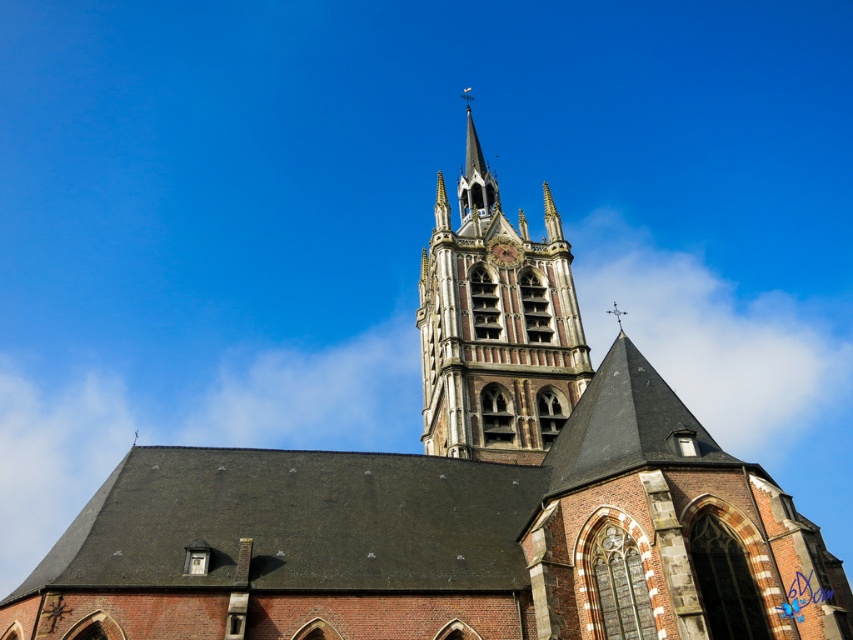
Question: Among these points, which one is nearest to the camera?

Choices:
 (A) (468, 182)
 (B) (430, 256)
 (C) (498, 246)

Answer: (C)

Question: Which object is closer to the camera taking this photo?

Choices:
 (A) polished silver spire at upper center
 (B) brown stone tower at center

Answer: (B)

Question: Which object appears farthest from the camera in this image?

Choices:
 (A) brown stone tower at center
 (B) polished silver spire at upper center

Answer: (B)

Question: Does polished silver spire at upper center appear over brass textured clock at upper center?

Choices:
 (A) yes
 (B) no

Answer: (A)

Question: Does brown stone tower at center have a greater width compared to brass textured clock at upper center?

Choices:
 (A) yes
 (B) no

Answer: (A)

Question: Is brown stone tower at center closer to camera compared to polished silver spire at upper center?

Choices:
 (A) no
 (B) yes

Answer: (B)